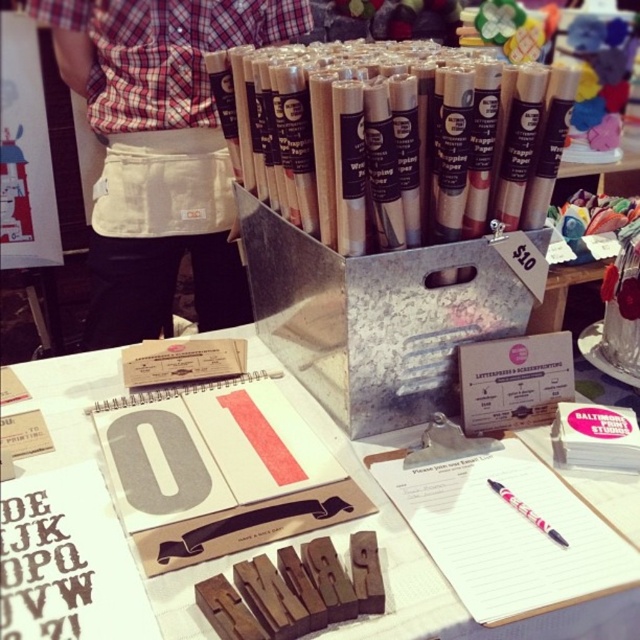
You are standing in front of the craft table and want to reach two points on the table. The first point is at coordinates point (417, 202) and the second is at point (461, 624). Which point is closer to you?

Point (417, 202) is closer to you because it is further to the viewer than point (461, 624).

You are organizing a craft fair booth and need to arrange items on a table. You have the wooden wrapping paper rolls at upper center and the wooden letterpress blocks at center. Which item takes up more space on the table?

The wooden letterpress blocks at center take up more space than the wooden wrapping paper rolls at upper center because the wooden wrapping paper rolls at upper center occupies less space than wooden letterpress blocks at center.